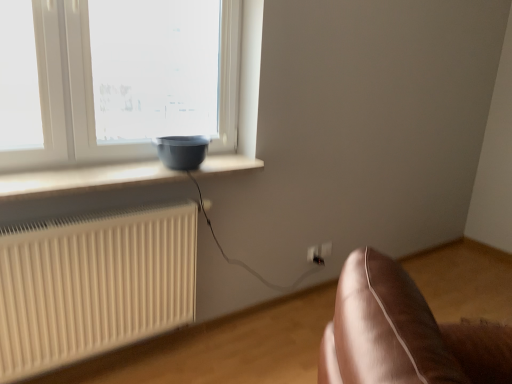
Question: From a real-world perspective, does matte gray bowl at window sit lower than white ribbed radiator at lower left?

Choices:
 (A) no
 (B) yes

Answer: (A)

Question: Considering the relative sizes of matte gray bowl at window and white ribbed radiator at lower left in the image provided, is matte gray bowl at window wider than white ribbed radiator at lower left?

Choices:
 (A) yes
 (B) no

Answer: (A)

Question: Is matte gray bowl at window oriented away from white ribbed radiator at lower left?

Choices:
 (A) yes
 (B) no

Answer: (B)

Question: Does matte gray bowl at window have a smaller size compared to white ribbed radiator at lower left?

Choices:
 (A) yes
 (B) no

Answer: (A)

Question: Is matte gray bowl at window not near white ribbed radiator at lower left?

Choices:
 (A) yes
 (B) no

Answer: (B)

Question: Visually, is white ribbed radiator at lower left positioned to the left or to the right of white plastic electric outlet at lower right, the first electric outlet viewed from the right?

Choices:
 (A) left
 (B) right

Answer: (A)

Question: Does point (155, 211) appear closer or farther from the camera than point (320, 251)?

Choices:
 (A) farther
 (B) closer

Answer: (B)

Question: Choose the correct answer: Is white ribbed radiator at lower left inside white plastic electric outlet at lower right, the second electric outlet when ordered from left to right, or outside it?

Choices:
 (A) inside
 (B) outside

Answer: (B)

Question: Looking at their shapes, would you say white ribbed radiator at lower left is wider or thinner than white plastic electric outlet at lower right, the second electric outlet when ordered from left to right?

Choices:
 (A) thin
 (B) wide

Answer: (B)

Question: From a real-world perspective, relative to matte gray bowl at window, is white ribbed radiator at lower left vertically above or below?

Choices:
 (A) above
 (B) below

Answer: (B)

Question: Visually, is white ribbed radiator at lower left positioned to the left or to the right of matte gray bowl at window?

Choices:
 (A) left
 (B) right

Answer: (A)

Question: Considering the positions of point (188, 317) and point (192, 142), is point (188, 317) closer or farther from the camera than point (192, 142)?

Choices:
 (A) closer
 (B) farther

Answer: (B)

Question: Considering their positions, is white ribbed radiator at lower left located in front of or behind matte gray bowl at window?

Choices:
 (A) front
 (B) behind

Answer: (A)

Question: Considering the positions of matte black bowl at left and matte gray bowl at window in the image, is matte black bowl at left wider or thinner than matte gray bowl at window?

Choices:
 (A) wide
 (B) thin

Answer: (A)

Question: Is matte black bowl at left inside or outside of matte gray bowl at window?

Choices:
 (A) inside
 (B) outside

Answer: (B)